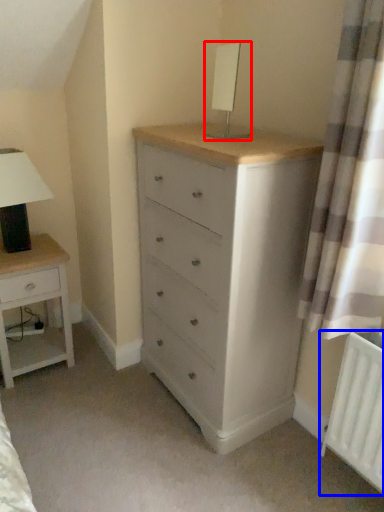
Question: Which of the following is the farthest to the observer, table lamp (highlighted by a red box) or radiator (highlighted by a blue box)?

Choices:
 (A) table lamp
 (B) radiator

Answer: (A)